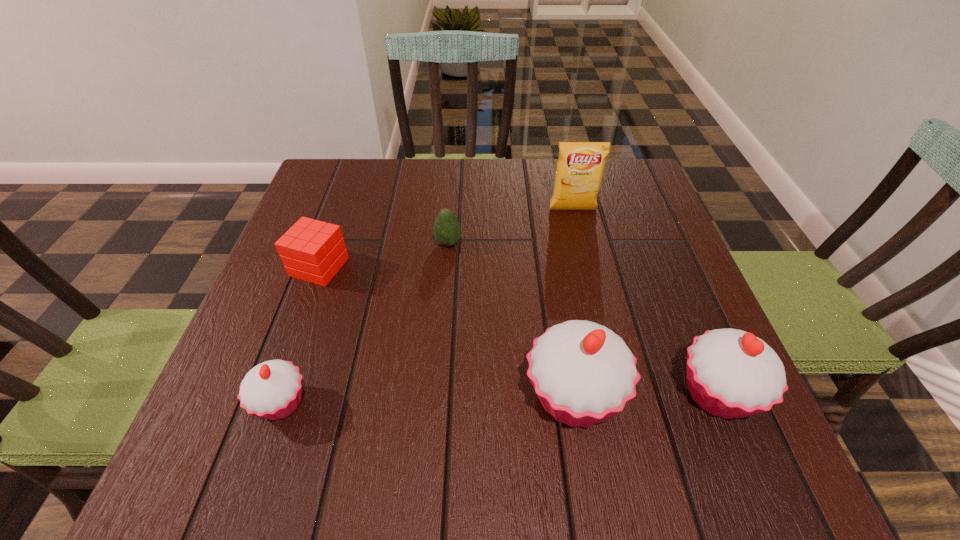
Where is `vacant area in the image that satisfies the following two spatial constraints: 1. on the front of the rightmost cupcake with the logo; 2. on the left side of the farthest object`? Image resolution: width=960 pixels, height=540 pixels. vacant area in the image that satisfies the following two spatial constraints: 1. on the front of the rightmost cupcake with the logo; 2. on the left side of the farthest object is located at coordinates (616, 394).

The image size is (960, 540). I want to click on free region that satisfies the following two spatial constraints: 1. on the back side of the avocado; 2. on the left side of the shortest cupcake, so click(335, 244).

This screenshot has width=960, height=540. Identify the location of free region that satisfies the following two spatial constraints: 1. on the front of the rightmost cupcake with the logo; 2. on the left side of the crisp (potato chip). (616, 394).